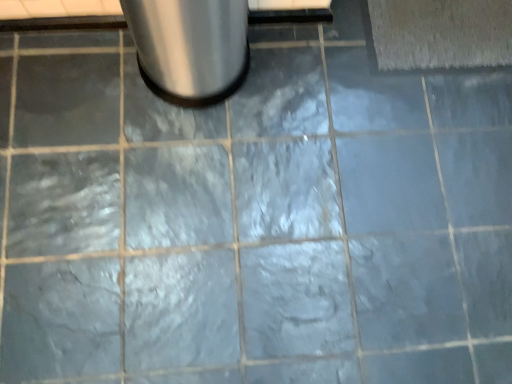
Question: Can you confirm if satin silver trash can at upper left is thinner than beige textured bath mat at upper right?

Choices:
 (A) yes
 (B) no

Answer: (B)

Question: Does satin silver trash can at upper left appear on the left side of beige textured bath mat at upper right?

Choices:
 (A) yes
 (B) no

Answer: (A)

Question: Does satin silver trash can at upper left come behind beige textured bath mat at upper right?

Choices:
 (A) no
 (B) yes

Answer: (A)

Question: Is satin silver trash can at upper left outside beige textured bath mat at upper right?

Choices:
 (A) yes
 (B) no

Answer: (A)

Question: From a real-world perspective, is satin silver trash can at upper left physically below beige textured bath mat at upper right?

Choices:
 (A) no
 (B) yes

Answer: (A)

Question: Are satin silver trash can at upper left and beige textured bath mat at upper right located far from each other?

Choices:
 (A) no
 (B) yes

Answer: (A)

Question: From a real-world perspective, is beige textured bath mat at upper right located higher than satin silver trash can at upper left?

Choices:
 (A) no
 (B) yes

Answer: (A)

Question: Is beige textured bath mat at upper right taller than satin silver trash can at upper left?

Choices:
 (A) no
 (B) yes

Answer: (A)

Question: Is beige textured bath mat at upper right to the left of satin silver trash can at upper left from the viewer's perspective?

Choices:
 (A) yes
 (B) no

Answer: (B)

Question: Does beige textured bath mat at upper right have a lesser width compared to satin silver trash can at upper left?

Choices:
 (A) yes
 (B) no

Answer: (A)

Question: Does beige textured bath mat at upper right have a larger size compared to satin silver trash can at upper left?

Choices:
 (A) yes
 (B) no

Answer: (B)

Question: Is beige textured bath mat at upper right not within satin silver trash can at upper left?

Choices:
 (A) no
 (B) yes

Answer: (B)

Question: Considering the positions of beige textured bath mat at upper right and satin silver trash can at upper left in the image, is beige textured bath mat at upper right taller or shorter than satin silver trash can at upper left?

Choices:
 (A) short
 (B) tall

Answer: (A)